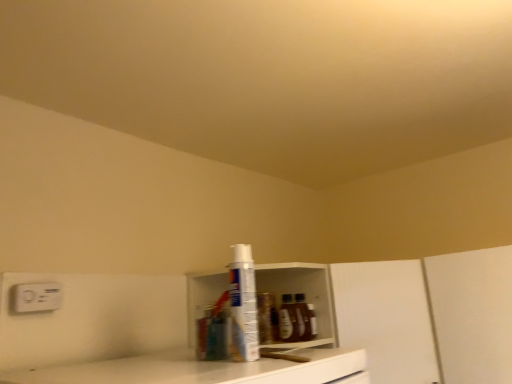
Question: Is white matte cabinet at center at the right side of white plastic electric outlet at upper left?

Choices:
 (A) yes
 (B) no

Answer: (A)

Question: Is white matte cabinet at center in front of white plastic electric outlet at upper left?

Choices:
 (A) no
 (B) yes

Answer: (A)

Question: Considering the relative sizes of white matte cabinet at center and white plastic electric outlet at upper left in the image provided, is white matte cabinet at center thinner than white plastic electric outlet at upper left?

Choices:
 (A) no
 (B) yes

Answer: (A)

Question: Is white matte cabinet at center bigger than white plastic electric outlet at upper left?

Choices:
 (A) yes
 (B) no

Answer: (A)

Question: Is white matte cabinet at center turned away from white plastic electric outlet at upper left?

Choices:
 (A) yes
 (B) no

Answer: (B)

Question: From a real-world perspective, is white matte cabinet at center above or below white plastic electric outlet at upper left?

Choices:
 (A) above
 (B) below

Answer: (B)

Question: Would you say white matte cabinet at center is to the left or to the right of white plastic electric outlet at upper left in the picture?

Choices:
 (A) right
 (B) left

Answer: (A)

Question: Considering the positions of white matte cabinet at center and white plastic electric outlet at upper left in the image, is white matte cabinet at center bigger or smaller than white plastic electric outlet at upper left?

Choices:
 (A) small
 (B) big

Answer: (B)

Question: In terms of width, does white matte cabinet at center look wider or thinner when compared to white plastic electric outlet at upper left?

Choices:
 (A) thin
 (B) wide

Answer: (B)

Question: Would you say white matte cabinet at center is to the left or to the right of white plastic shelf at center in the picture?

Choices:
 (A) right
 (B) left

Answer: (A)

Question: In the image, is white matte cabinet at center positioned in front of or behind white plastic shelf at center?

Choices:
 (A) front
 (B) behind

Answer: (B)

Question: From a real-world perspective, is white matte cabinet at center physically located above or below white plastic shelf at center?

Choices:
 (A) above
 (B) below

Answer: (B)

Question: In terms of width, does white matte cabinet at center look wider or thinner when compared to white plastic shelf at center?

Choices:
 (A) wide
 (B) thin

Answer: (A)

Question: Does point (31, 283) appear closer or farther from the camera than point (433, 342)?

Choices:
 (A) closer
 (B) farther

Answer: (A)

Question: From a real-world perspective, is white plastic electric outlet at upper left positioned above or below white matte cabinet at center?

Choices:
 (A) above
 (B) below

Answer: (A)